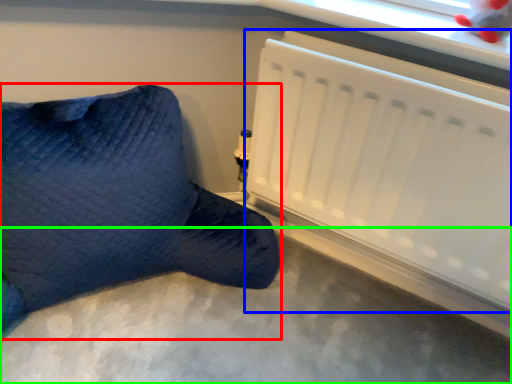
Question: Based on their relative distances, which object is nearer to furniture (highlighted by a red box)? Choose from radiator (highlighted by a blue box) and concrete (highlighted by a green box).

Choices:
 (A) radiator
 (B) concrete

Answer: (B)